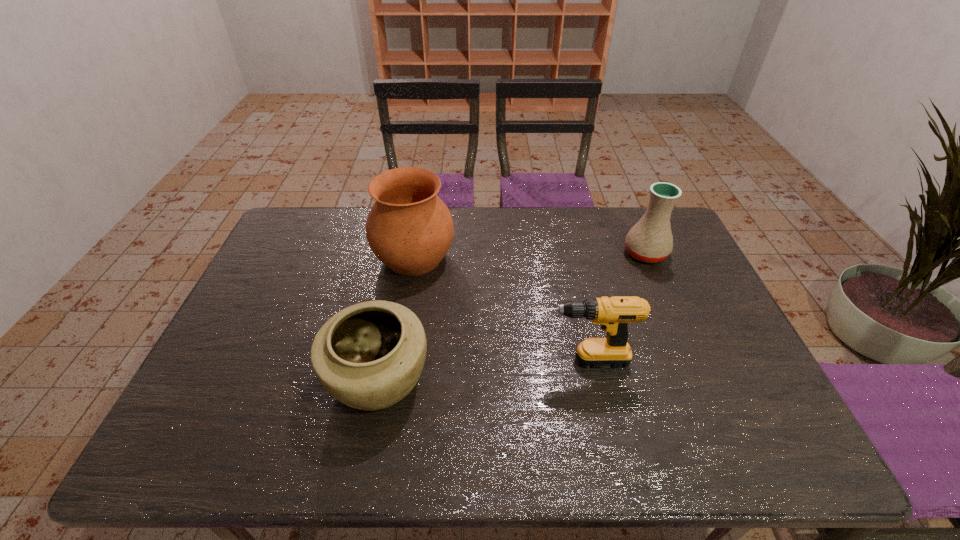
You are a GUI agent. You are given a task and a screenshot of the screen. Output one action in this format:
    pyautogui.click(x=<x>, y=<y>)
    Task: Click on the object present at the right edge
    This screenshot has height=540, width=960.
    Given the screenshot: What is the action you would take?
    pyautogui.click(x=650, y=240)

At what (x,y) coordinates should I click in order to perform the action: click on object that is positioned at the far right corner. Please return your answer as a coordinate pair (x, y). The image size is (960, 540). Looking at the image, I should click on (650, 240).

The height and width of the screenshot is (540, 960). In the image, there is a desktop. In order to click on vacant space at the far edge in this screenshot , I will do (x=508, y=215).

Where is `vacant space at the near edge of the desktop`? The image size is (960, 540). vacant space at the near edge of the desktop is located at coordinates [395, 462].

Identify the location of vacant space at the left edge. This screenshot has width=960, height=540. (296, 305).

The height and width of the screenshot is (540, 960). Identify the location of vacant space at the right edge. (653, 280).

This screenshot has width=960, height=540. In the image, there is a desktop. In order to click on free space at the far left corner in this screenshot , I will do `click(319, 209)`.

Where is `vacant space at the near left corner of the desktop`? This screenshot has height=540, width=960. vacant space at the near left corner of the desktop is located at coordinates (185, 431).

The image size is (960, 540). I want to click on unoccupied position between the shortest pottery and the drill, so click(x=477, y=370).

The width and height of the screenshot is (960, 540). I want to click on free spot between the second object from right to left and the shortest object, so click(x=477, y=370).